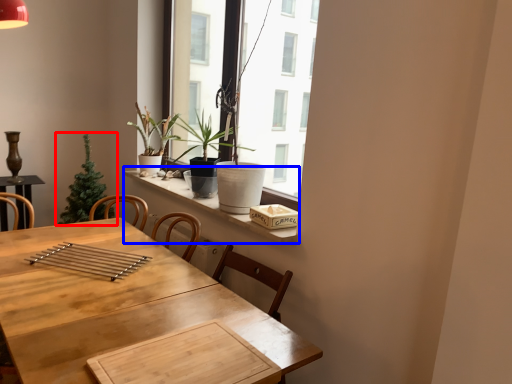
Question: Which of the following is the closest to the observer, houseplant (highlighted by a red box) or window sill (highlighted by a blue box)?

Choices:
 (A) houseplant
 (B) window sill

Answer: (B)